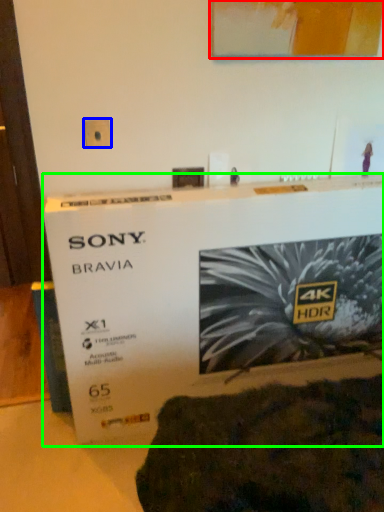
Question: Based on their relative distances, which object is nearer to picture frame (highlighted by a red box)? Choose from electric outlet (highlighted by a blue box) and poster (highlighted by a green box).

Choices:
 (A) electric outlet
 (B) poster

Answer: (A)